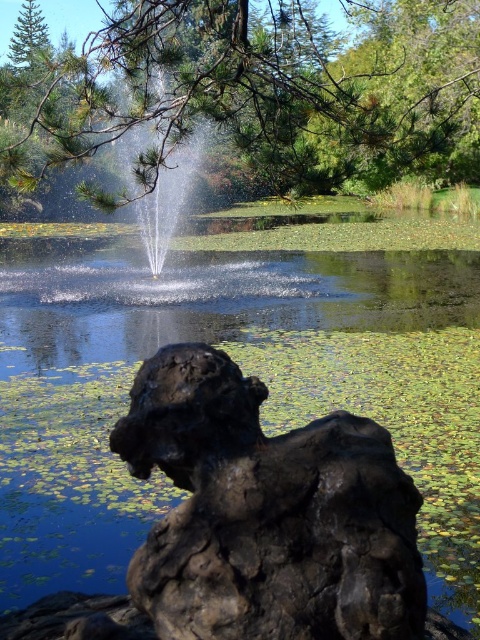
Describe the element at coordinates (243, 371) in the screenshot. The image size is (480, 640). I see `green lily pads at center` at that location.

Looking at this image, is green lily pads at center smaller than rustic stone statue at center?

No.

Is point (380, 336) positioned behind point (372, 502)?

Yes, it is.

In order to click on green lily pads at center in this screenshot , I will do point(243,371).

Can you confirm if green matte tree branches at upper center is positioned above rustic stone statue at center?

Indeed, green matte tree branches at upper center is positioned over rustic stone statue at center.

Does green matte tree branches at upper center have a lesser height compared to rustic stone statue at center?

No, green matte tree branches at upper center is not shorter than rustic stone statue at center.

Is point (359, 122) less distant than point (352, 534)?

No, it is behind (352, 534).

Where is `green matte tree branches at upper center`? This screenshot has height=640, width=480. green matte tree branches at upper center is located at coordinates (252, 92).

Can you confirm if green lily pads at center is shorter than green matte tree branches at upper center?

Indeed, green lily pads at center has a lesser height compared to green matte tree branches at upper center.

From the picture: Is green lily pads at center positioned in front of green matte tree branches at upper center?

Yes, green lily pads at center is in front of green matte tree branches at upper center.

The height and width of the screenshot is (640, 480). What are the coordinates of `green lily pads at center` in the screenshot? It's located at (243, 371).